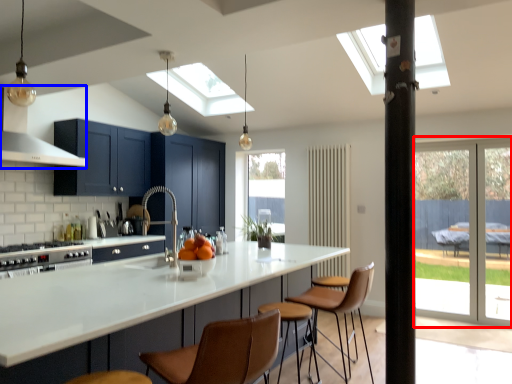
Question: Among these objects, which one is farthest to the camera, screen door (highlighted by a red box) or exhaust hood (highlighted by a blue box)?

Choices:
 (A) screen door
 (B) exhaust hood

Answer: (A)